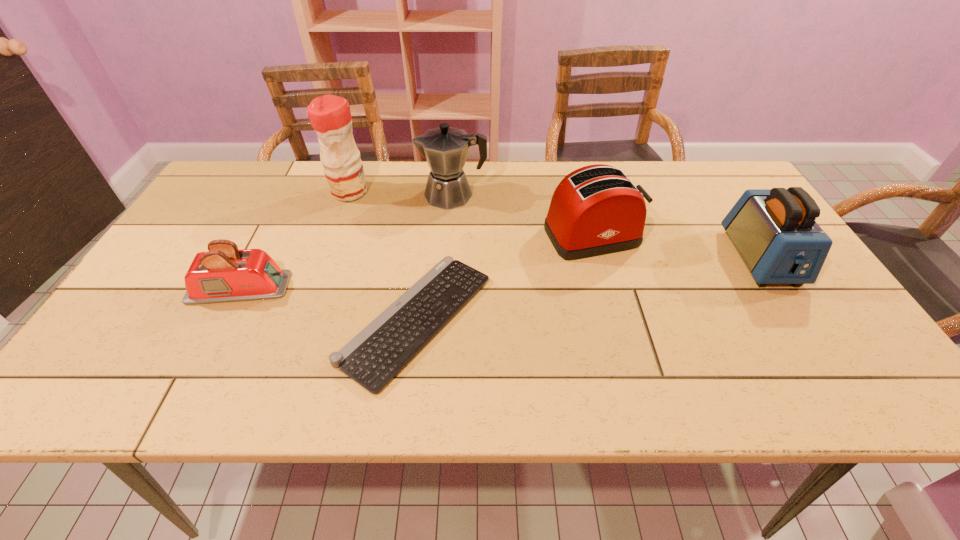
Image resolution: width=960 pixels, height=540 pixels. I want to click on the fifth object from right to left, so click(x=330, y=116).

At what (x,y) coordinates should I click in order to perform the action: click on condiment. Please return your answer as a coordinate pair (x, y). Looking at the image, I should click on (330, 116).

What are the coordinates of `the fifth shortest object` in the screenshot? It's located at (x=445, y=148).

Locate an element on the screen. This screenshot has width=960, height=540. the rightmost toaster is located at coordinates (774, 230).

Where is `the fifth object from left to right`? the fifth object from left to right is located at coordinates (595, 210).

Locate an element on the screen. The image size is (960, 540). the shortest toaster is located at coordinates (224, 274).

Where is `the leftmost object`? Image resolution: width=960 pixels, height=540 pixels. the leftmost object is located at coordinates pyautogui.click(x=224, y=274).

The width and height of the screenshot is (960, 540). What are the coordinates of `the shortest object` in the screenshot? It's located at click(376, 354).

Locate an element on the screen. This screenshot has width=960, height=540. vacant region located 0.280m on the right of the fifth object from right to left is located at coordinates (460, 192).

Find the location of `vacant space located 0.360m at the spout of the coffeepot`. vacant space located 0.360m at the spout of the coffeepot is located at coordinates (298, 195).